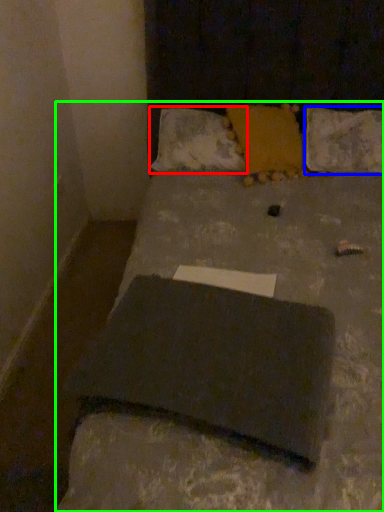
Question: Based on their relative distances, which object is farther from pillow (highlighted by a red box)? Choose from pillow (highlighted by a blue box) and bed (highlighted by a green box).

Choices:
 (A) pillow
 (B) bed

Answer: (B)